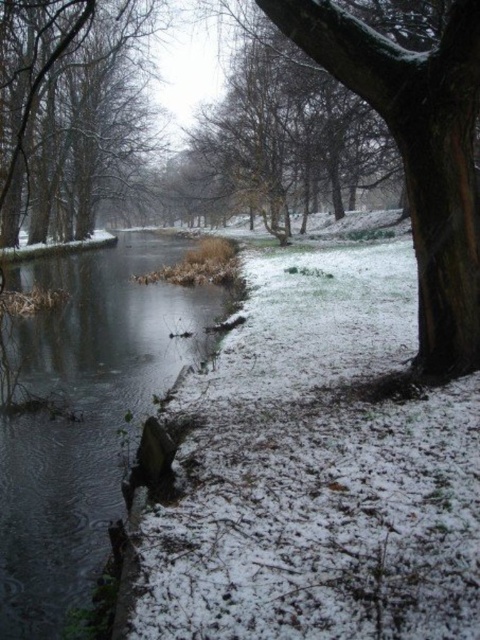
You are standing at the riverbank and want to take a photo. There are two points marked in the image, point (x=168, y=308) and point (x=156, y=12). Which point is closer to you when you are facing the river?

Point (x=168, y=308) is closer to the camera than point (x=156, y=12), so when facing the river, point (x=168, y=308) is closer to you.

Looking at this image, you are standing on the snow covered ground and want to walk from the clear water at center to the smooth bark tree at left. Which direction should you head?

The clear water at center is shorter than the smooth bark tree at left, so you should head towards the left direction to reach the smooth bark tree at left from the clear water at center.